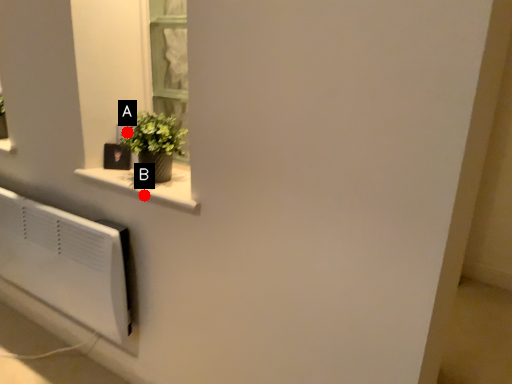
Question: Two points are circled on the image, labeled by A and B beside each circle. Which point is closer to the camera taking this photo?

Choices:
 (A) A is closer
 (B) B is closer

Answer: (B)